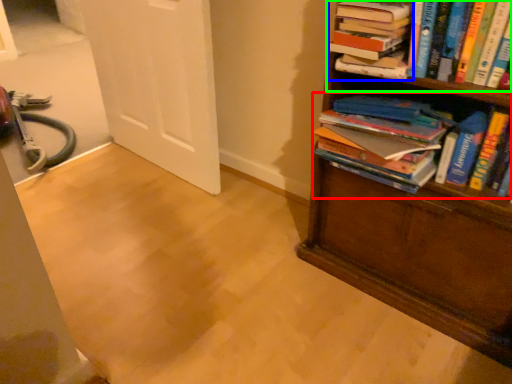
Question: Which object is the farthest from book (highlighted by a red box)? Choose among these: book (highlighted by a blue box) or book (highlighted by a green box).

Choices:
 (A) book
 (B) book

Answer: (A)